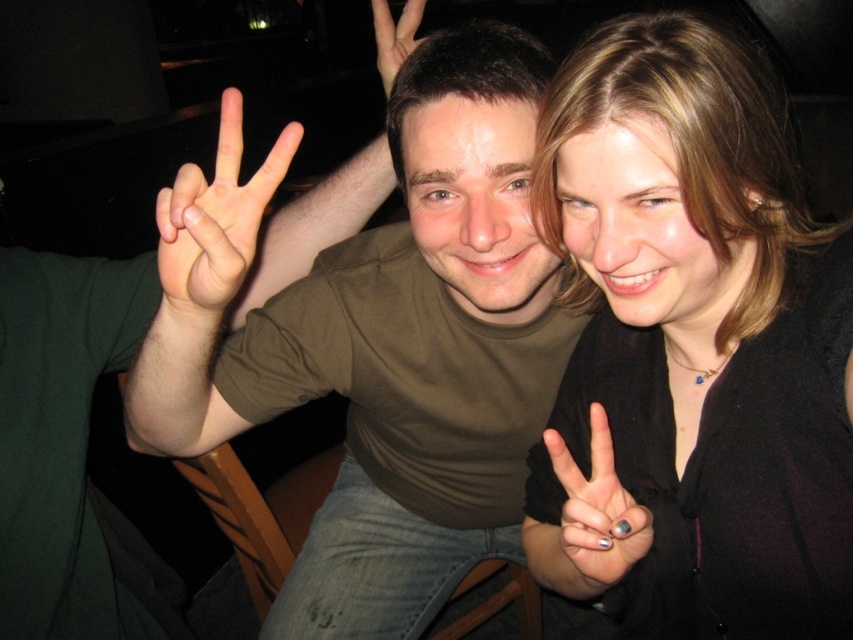
In the scene shown: You are a photographer trying to focus on the matte skin hand at center. Where exactly should you point your camera to capture it?

You should point your camera at point coordinates [218,216] to capture the matte skin hand at center.

You are a photographer adjusting lighting for a closeup shot of the hands in the image. The matte skin hand at center and the nail polish painted fingernails at right are both in focus. If you need to ensure the wider hand remains in focus while adjusting the lighting, which hand should you pay more attention to?

The matte skin hand at center has a larger width than the nail polish painted fingernails at right, so you should focus more on the matte skin hand at center to ensure proper focus.